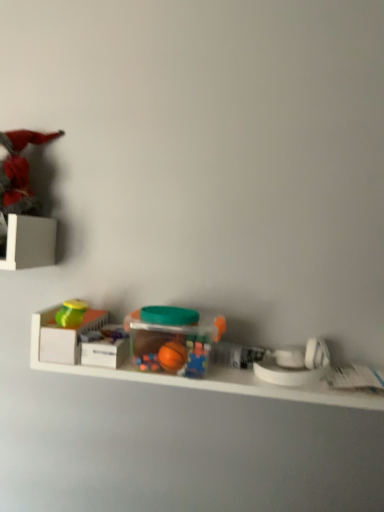
Question: Is white plastic toy at right, the first toy positioned from the right, bigger than white matte storage box at left?

Choices:
 (A) no
 (B) yes

Answer: (B)

Question: Can you confirm if white plastic toy at right, arranged as the first toy when ordered from the bottom, is taller than white matte storage box at left?

Choices:
 (A) no
 (B) yes

Answer: (B)

Question: From a real-world perspective, is white plastic toy at right, arranged as the first toy when ordered from the bottom, under white matte storage box at left?

Choices:
 (A) no
 (B) yes

Answer: (A)

Question: Is white plastic toy at right, the first toy positioned from the right, smaller than white matte storage box at left?

Choices:
 (A) no
 (B) yes

Answer: (A)

Question: Can we say white plastic toy at right, acting as the 4th toy starting from the top, lies outside white matte storage box at left?

Choices:
 (A) no
 (B) yes

Answer: (B)

Question: Would you say white plastic toy at right, placed as the fourth toy when sorted from left to right, contains white matte storage box at left?

Choices:
 (A) no
 (B) yes

Answer: (A)

Question: Considering the relative sizes of white plastic toy at right, arranged as the first toy when ordered from the bottom, and matte green lid at left, the third toy viewed from the right, in the image provided, is white plastic toy at right, arranged as the first toy when ordered from the bottom, thinner than matte green lid at left, the third toy viewed from the right,?

Choices:
 (A) yes
 (B) no

Answer: (B)

Question: Would you say matte green lid at left, the second toy from the top, is part of white plastic toy at right, arranged as the first toy when ordered from the bottom,'s contents?

Choices:
 (A) yes
 (B) no

Answer: (B)

Question: Does white plastic toy at right, arranged as the first toy when ordered from the bottom, come behind matte green lid at left, the second toy from the top?

Choices:
 (A) yes
 (B) no

Answer: (B)

Question: Considering the relative sizes of white plastic toy at right, arranged as the first toy when ordered from the bottom, and matte green lid at left, which appears as the 2th toy when viewed from the left, in the image provided, is white plastic toy at right, arranged as the first toy when ordered from the bottom, bigger than matte green lid at left, which appears as the 2th toy when viewed from the left,?

Choices:
 (A) yes
 (B) no

Answer: (A)

Question: From a real-world perspective, is white plastic toy at right, arranged as the first toy when ordered from the bottom, under matte green lid at left, the second toy from the top?

Choices:
 (A) yes
 (B) no

Answer: (A)

Question: Is the depth of white plastic toy at right, the first toy positioned from the right, less than that of matte green lid at left, the third toy viewed from the right?

Choices:
 (A) no
 (B) yes

Answer: (B)

Question: Does white matte storage box at left have a lesser height compared to translucent plastic container at center, which is counted as the second toy, starting from the bottom?

Choices:
 (A) yes
 (B) no

Answer: (A)